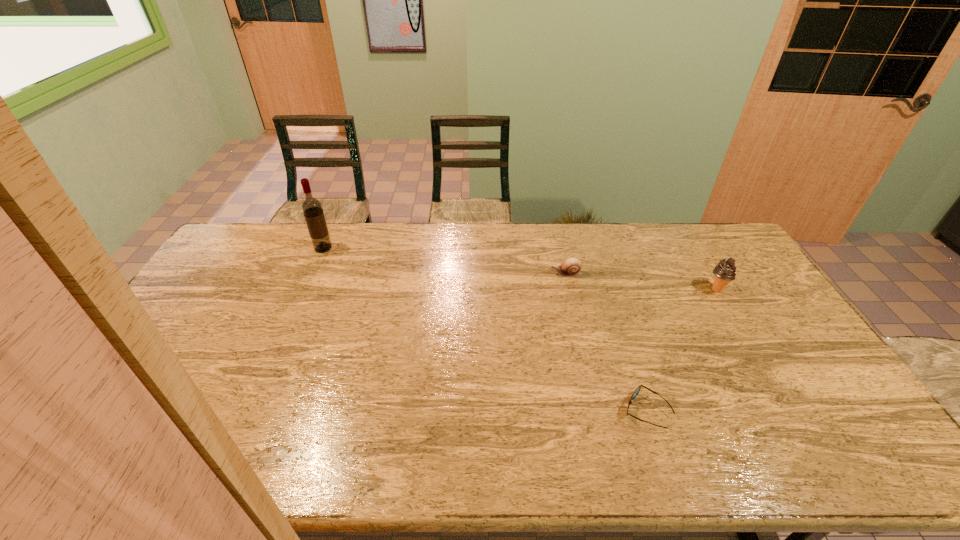
Find the location of `vacant region between the rightmost object and the farthest object`. vacant region between the rightmost object and the farthest object is located at coordinates (520, 269).

Identify the location of vacant area that lies between the third object from left to right and the rightmost object. (682, 350).

Where is `vacant space that is in between the shortest object and the third shortest object`? The image size is (960, 540). vacant space that is in between the shortest object and the third shortest object is located at coordinates (682, 350).

Locate an element on the screen. This screenshot has height=540, width=960. object that is the second closest to the icecream is located at coordinates [637, 390].

The image size is (960, 540). Find the location of `the third closest object relative to the wine bottle`. the third closest object relative to the wine bottle is located at coordinates (725, 271).

The image size is (960, 540). Identify the location of vacant region that satisfies the following two spatial constraints: 1. on the front-facing side of the rightmost object; 2. on the right side of the third object from right to left. (569, 290).

The height and width of the screenshot is (540, 960). Identify the location of vacant space that satisfies the following two spatial constraints: 1. on the front-facing side of the second shortest object; 2. on the right side of the second tallest object. (569, 290).